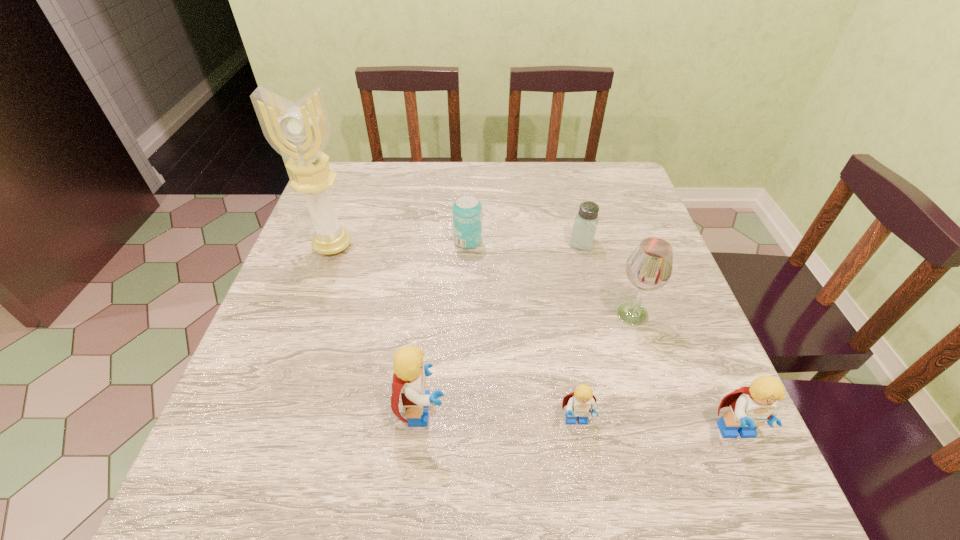
The height and width of the screenshot is (540, 960). In order to click on the leftmost Lego in this screenshot , I will do `click(409, 375)`.

Find the location of a particular element. Image resolution: width=960 pixels, height=540 pixels. the fourth object from right to left is located at coordinates (579, 403).

Image resolution: width=960 pixels, height=540 pixels. Identify the location of the second Lego from left to right. (579, 403).

Identify the location of the second shortest Lego. (750, 407).

The width and height of the screenshot is (960, 540). What are the coordinates of `the rightmost Lego` in the screenshot? It's located at (750, 407).

Locate an element on the screen. saltshaker is located at coordinates (585, 225).

The image size is (960, 540). In order to click on beer can in this screenshot , I will do `click(467, 210)`.

Where is `the leftmost object`? the leftmost object is located at coordinates (300, 131).

At what (x,y) coordinates should I click in order to perform the action: click on the tallest object. Please return your answer as a coordinate pair (x, y). This screenshot has width=960, height=540. Looking at the image, I should click on (300, 131).

Where is `wineglass`? This screenshot has width=960, height=540. wineglass is located at coordinates 649,267.